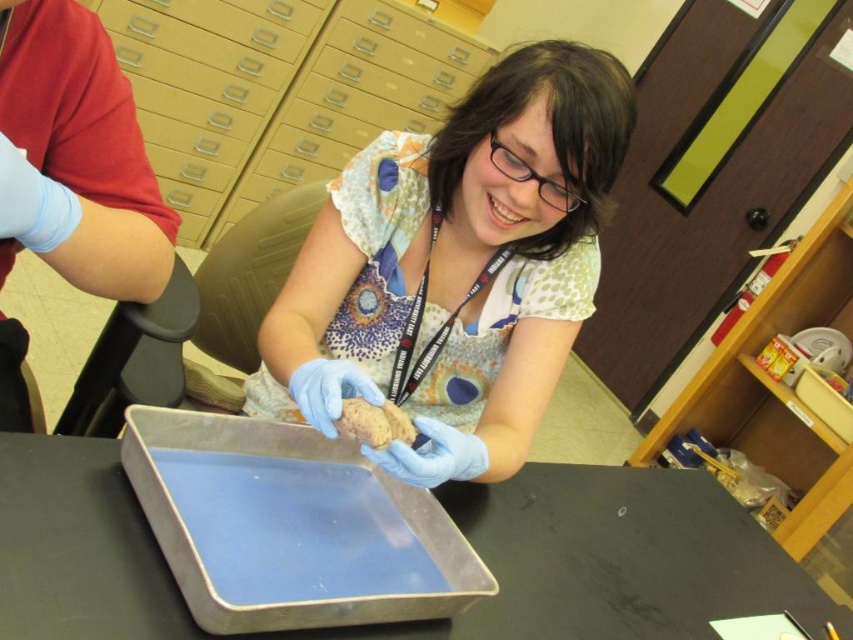
Question: Which point is farther from the camera taking this photo?

Choices:
 (A) (741, 576)
 (B) (367, 240)

Answer: (A)

Question: Which of the following is the closest to the observer?

Choices:
 (A) (511, 342)
 (B) (103, 490)

Answer: (B)

Question: In this image, where is matte brown rock at center located relative to metallic gray tray at center?

Choices:
 (A) left
 (B) right

Answer: (A)

Question: In this image, where is matte brown rock at center located relative to metallic gray tray at center?

Choices:
 (A) left
 (B) right

Answer: (A)

Question: In this image, where is matte brown rock at center located relative to metallic gray tray at center?

Choices:
 (A) right
 (B) left

Answer: (B)